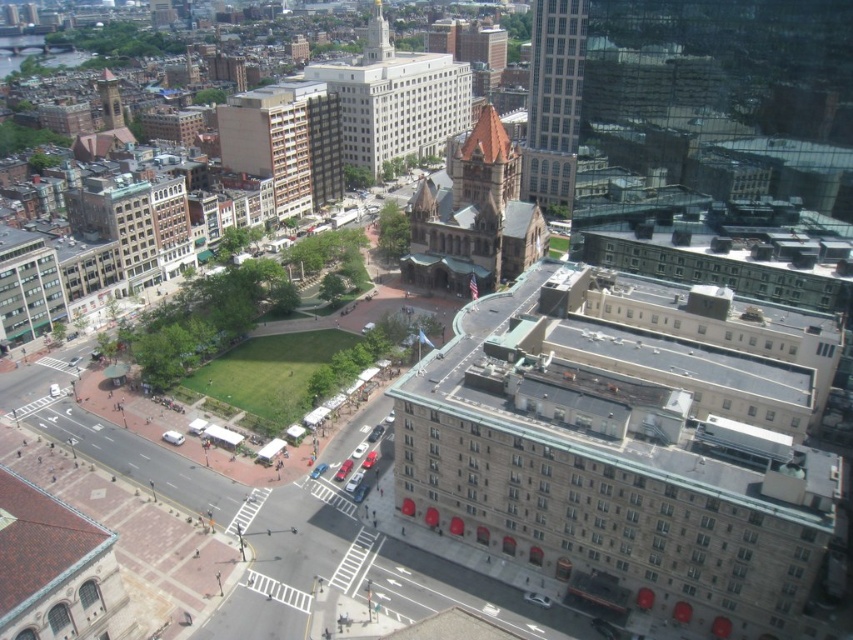
Question: Can you confirm if light brown brick building at upper center is positioned above gold textured spire at upper center?

Choices:
 (A) no
 (B) yes

Answer: (A)

Question: Considering the real-world distances, which object is farthest from the glassy reflective skyscraper at upper right?

Choices:
 (A) gold textured spire at upper center
 (B) white stone building at center
 (C) light brown brick building at upper center

Answer: (A)

Question: Which object is closer to the camera taking this photo?

Choices:
 (A) gold textured spire at upper center
 (B) light brown brick building at upper center
 (C) brown stone church at center
 (D) white stone building at center

Answer: (C)

Question: From the image, what is the correct spatial relationship of brown stone church at center in relation to light brown brick building at upper center?

Choices:
 (A) left
 (B) right

Answer: (B)

Question: Can you confirm if light brown brick building at upper center is positioned above glassy reflective skyscraper at upper right?

Choices:
 (A) yes
 (B) no

Answer: (B)

Question: Estimate the real-world distances between objects in this image. Which object is closer to the glassy reflective skyscraper at upper right?

Choices:
 (A) white stone building at center
 (B) light brown brick building at upper center
 (C) gold textured spire at upper center
 (D) brown stone church at center

Answer: (D)